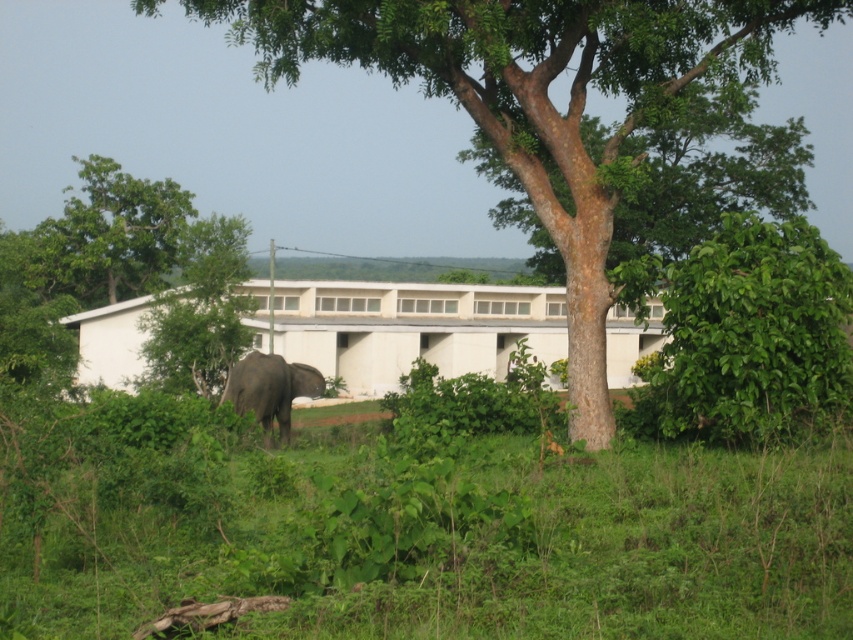
Looking at this image, you are a gardener who needs to water the green leafy grass at lower center and the brown rough tree at center. Your watering can has a range of 5 meters. Can you water both without moving the can?

The green leafy grass at lower center and the brown rough tree at center are 6.11 meters apart, so the watering can with a 5 meter range cannot reach both without moving it.

You are a photographer standing in the scene and want to capture both the green leafy grass at lower center and the gray matte elephant at center in your shot. Which object will appear larger in the photo?

The green leafy grass at lower center will appear larger in the photo because it is bigger than the gray matte elephant at center.

You are a gardener standing at the edge of the green leafy grass at lower center. You need to water the gray matte elephant at center. Can you reach it with a standard garden hose that has a maximum reach of 10 meters?

The distance between the green leafy grass at lower center and the gray matte elephant at center is 13.36 meters, which exceeds the 10 meter reach of the standard garden hose. Therefore, you cannot reach the gray matte elephant at center with the hose.